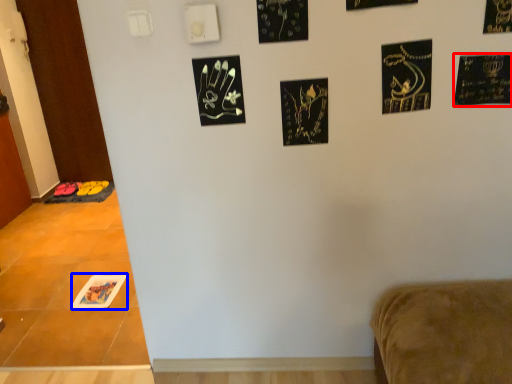
Question: Among these objects, which one is farthest to the camera, postcard (highlighted by a red box) or print (highlighted by a blue box)?

Choices:
 (A) postcard
 (B) print

Answer: (B)